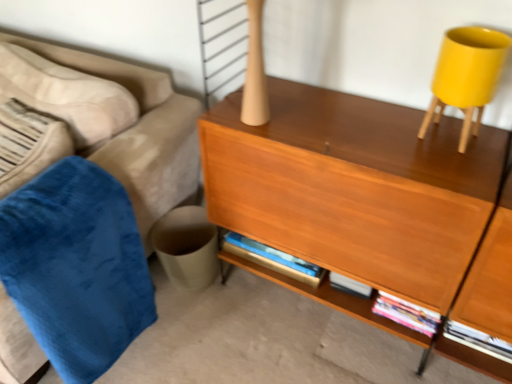
Question: Is velvet blue blanket at left behind wooden desk at center?

Choices:
 (A) yes
 (B) no

Answer: (A)

Question: Considering the relative sizes of velvet blue blanket at left and wooden desk at center in the image provided, is velvet blue blanket at left taller than wooden desk at center?

Choices:
 (A) no
 (B) yes

Answer: (A)

Question: Can you confirm if velvet blue blanket at left is positioned to the left of wooden desk at center?

Choices:
 (A) no
 (B) yes

Answer: (B)

Question: From the image's perspective, is velvet blue blanket at left on top of wooden desk at center?

Choices:
 (A) yes
 (B) no

Answer: (B)

Question: From a real-world perspective, is velvet blue blanket at left under wooden desk at center?

Choices:
 (A) no
 (B) yes

Answer: (B)

Question: Considering the relative sizes of velvet blue blanket at left and wooden desk at center in the image provided, is velvet blue blanket at left bigger than wooden desk at center?

Choices:
 (A) no
 (B) yes

Answer: (A)

Question: Does matte yellow plastic swivel chair at upper right have a lesser height compared to velvet blue couch at left?

Choices:
 (A) no
 (B) yes

Answer: (B)

Question: Is matte yellow plastic swivel chair at upper right surrounding velvet blue couch at left?

Choices:
 (A) yes
 (B) no

Answer: (B)

Question: Does matte yellow plastic swivel chair at upper right have a smaller size compared to velvet blue couch at left?

Choices:
 (A) no
 (B) yes

Answer: (B)

Question: Is matte yellow plastic swivel chair at upper right directly adjacent to velvet blue couch at left?

Choices:
 (A) yes
 (B) no

Answer: (B)

Question: From the image's perspective, is matte yellow plastic swivel chair at upper right below velvet blue couch at left?

Choices:
 (A) yes
 (B) no

Answer: (B)

Question: Considering the relative sizes of matte yellow plastic swivel chair at upper right and velvet blue couch at left in the image provided, is matte yellow plastic swivel chair at upper right wider than velvet blue couch at left?

Choices:
 (A) yes
 (B) no

Answer: (B)

Question: From a real-world perspective, is wooden desk at center over velvet blue blanket at left?

Choices:
 (A) no
 (B) yes

Answer: (B)